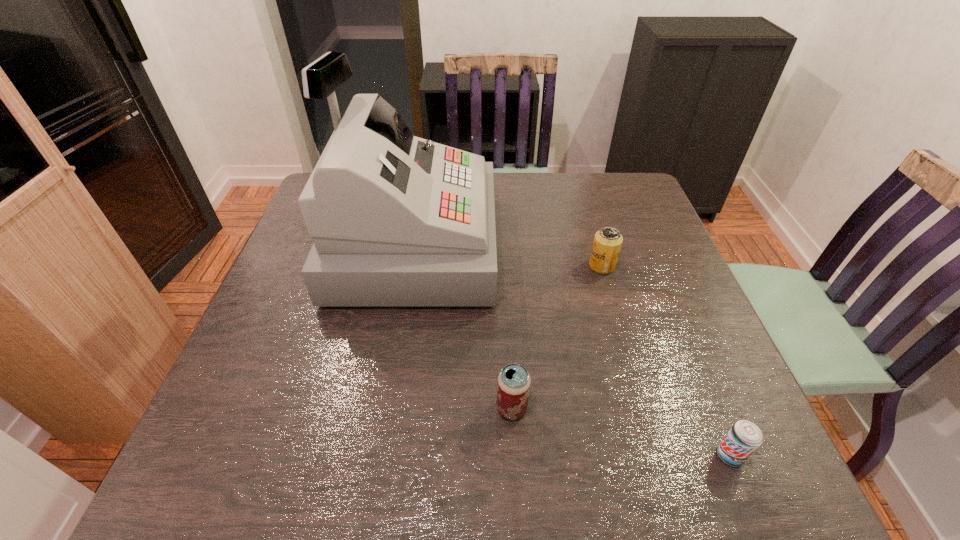
This screenshot has height=540, width=960. In order to click on free region located 0.130m on the back of the shortest object in this screenshot , I will do `click(699, 381)`.

Identify the location of object at the far edge. (397, 221).

At what (x,y) coordinates should I click in order to perform the action: click on object that is at the near edge. Please return your answer as a coordinate pair (x, y). Looking at the image, I should click on (744, 437).

Identify the location of object that is at the left edge. (397, 221).

Image resolution: width=960 pixels, height=540 pixels. What are the coordinates of `object situated at the far left corner` in the screenshot? It's located at (397, 221).

Identify the location of object that is at the near right corner. The width and height of the screenshot is (960, 540). (744, 437).

Find the location of a particular element. vacant area at the far edge is located at coordinates (588, 214).

The image size is (960, 540). Identify the location of free space at the near edge of the desktop. (570, 454).

In the image, there is a desktop. At what (x,y) coordinates should I click in order to perform the action: click on blank space at the left edge. Please return your answer as a coordinate pair (x, y). Image resolution: width=960 pixels, height=540 pixels. Looking at the image, I should click on (225, 423).

Identify the location of vacant space at the right edge of the desktop. (704, 320).